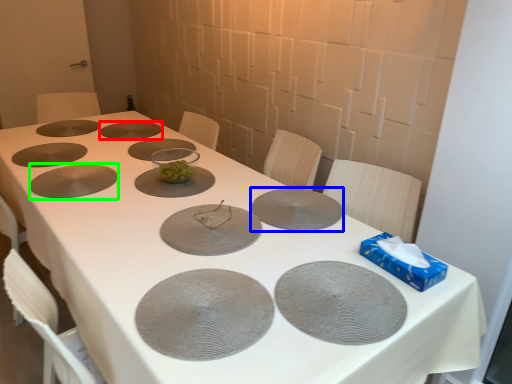
Question: Based on their relative distances, which object is farther from glass plate (highlighted by a red box)? Choose from glass plate (highlighted by a blue box) and glass plate (highlighted by a green box).

Choices:
 (A) glass plate
 (B) glass plate

Answer: (A)